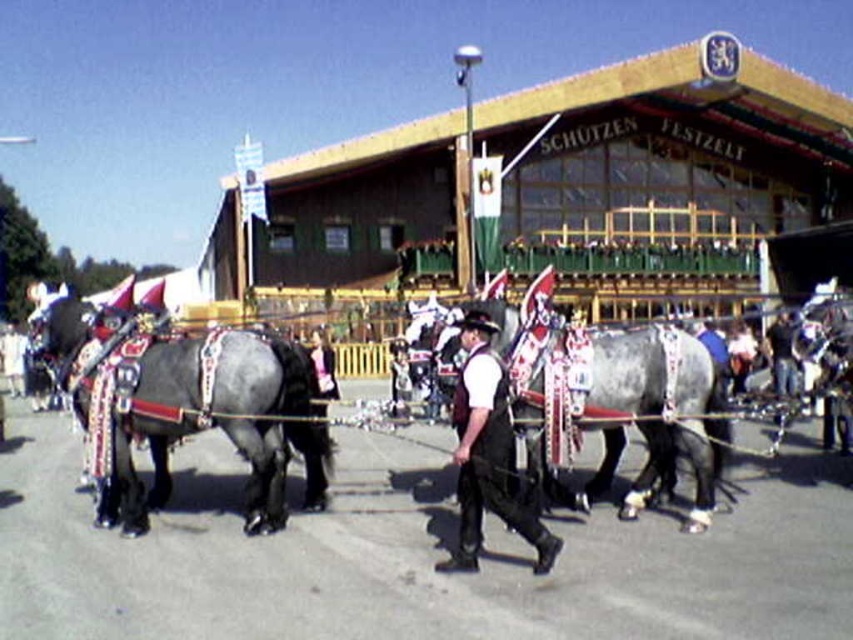
Question: Does gray glossy horse at center appear on the left side of white shirt and dark vest at center?

Choices:
 (A) yes
 (B) no

Answer: (B)

Question: Does shiny silver horse at center appear on the left side of shiny black horse at center?

Choices:
 (A) no
 (B) yes

Answer: (B)

Question: Which point is closer to the camera?

Choices:
 (A) shiny silver horse at center
 (B) shiny black horse at center
 (C) white shirt and dark vest at center
 (D) gray glossy horse at center

Answer: (C)

Question: Is shiny black horse at center to the left of white shirt and dark vest at center from the viewer's perspective?

Choices:
 (A) yes
 (B) no

Answer: (A)

Question: Which object is the farthest from the gray glossy horse at center?

Choices:
 (A) shiny silver horse at center
 (B) white shirt and dark vest at center

Answer: (B)

Question: Which object is positioned closest to the shiny black horse at center?

Choices:
 (A) shiny silver horse at center
 (B) white shirt and dark vest at center
 (C) gray glossy horse at center

Answer: (A)